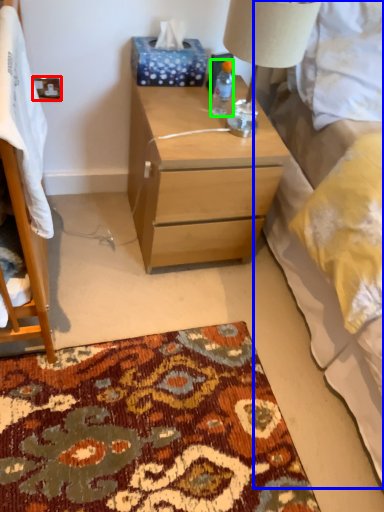
Question: Estimate the real-world distances between objects in this image. Which object is farther from power outlet (highlighted by a red box), bed (highlighted by a blue box) or bottle (highlighted by a green box)?

Choices:
 (A) bed
 (B) bottle

Answer: (A)